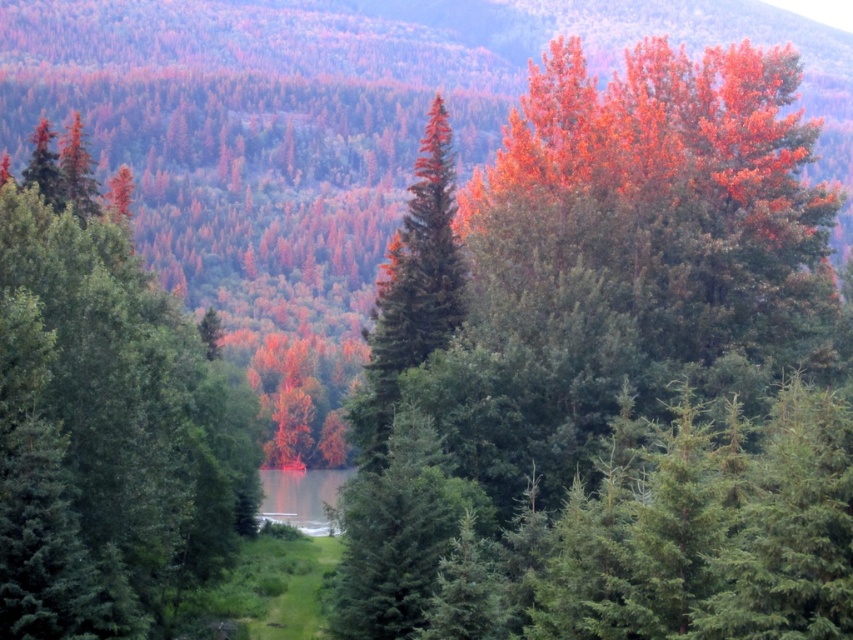
Question: From the image, what is the correct spatial relationship of orange-red foliage at center in relation to green matte tree at center?

Choices:
 (A) above
 (B) below

Answer: (A)

Question: Considering the relative positions of orange-red foliage at center and green matte tree at center in the image provided, where is orange-red foliage at center located with respect to green matte tree at center?

Choices:
 (A) above
 (B) below

Answer: (A)

Question: Which point is farther to the camera?

Choices:
 (A) orange-red foliage at center
 (B) green matte tree at center

Answer: (B)

Question: Does orange-red foliage at center have a larger size compared to green matte tree at center?

Choices:
 (A) no
 (B) yes

Answer: (B)

Question: Which point is closer to the camera?

Choices:
 (A) (426, 140)
 (B) (705, 378)

Answer: (B)